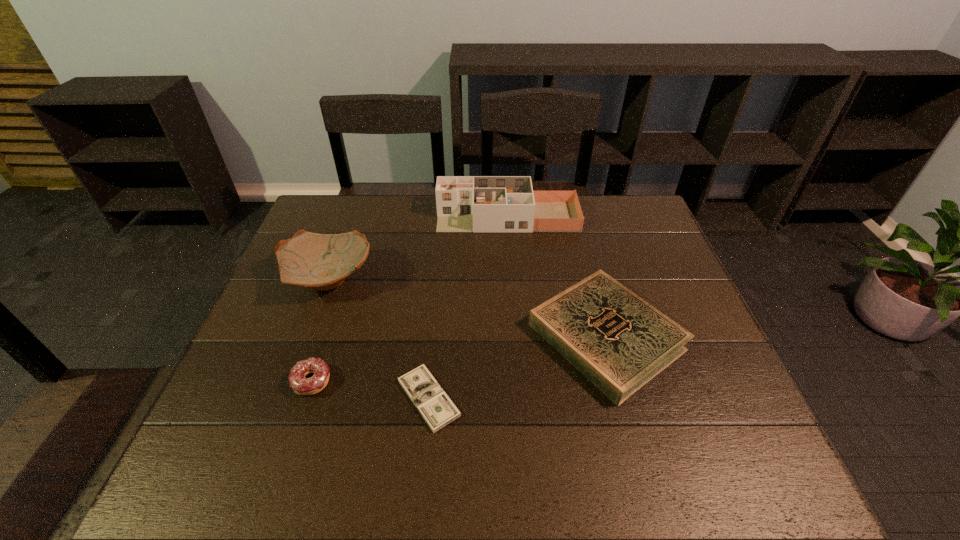
Locate an element on the screen. The width and height of the screenshot is (960, 540). vacant space at the far right corner of the desktop is located at coordinates (638, 220).

The height and width of the screenshot is (540, 960). In order to click on free space between the dollhouse and the third tallest object in this screenshot , I will do `click(557, 277)`.

Locate an element on the screen. empty space that is in between the dollar and the farthest object is located at coordinates (468, 307).

Locate an element on the screen. Image resolution: width=960 pixels, height=540 pixels. free space between the farthest object and the pottery is located at coordinates (418, 248).

The width and height of the screenshot is (960, 540). Find the location of `free area in between the dollar and the doughnut`. free area in between the dollar and the doughnut is located at coordinates click(370, 390).

Locate an element on the screen. This screenshot has height=540, width=960. free space between the dollhouse and the second shortest object is located at coordinates (410, 299).

What are the coordinates of `vacant area between the third tallest object and the dollar` in the screenshot? It's located at (517, 367).

Where is `empty location between the hardback book and the dollar`? The width and height of the screenshot is (960, 540). empty location between the hardback book and the dollar is located at coordinates (517, 367).

At what (x,y) coordinates should I click in order to perform the action: click on free spot between the dollhouse and the pottery. Please return your answer as a coordinate pair (x, y). This screenshot has width=960, height=540. Looking at the image, I should click on (418, 248).

Find the location of a particular element. This screenshot has width=960, height=540. empty space between the dollar and the pottery is located at coordinates (378, 339).